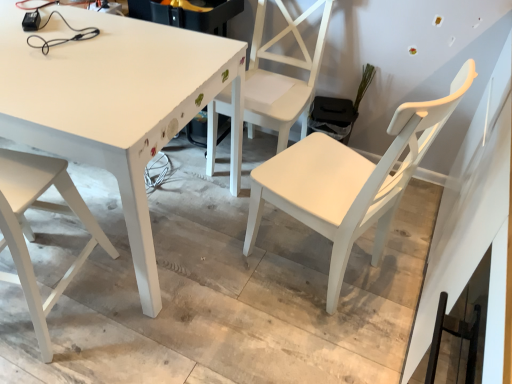
Question: Is white matte chair at lower left, placed as the third chair when sorted from right to left, taller than white matte chair at center, arranged as the second chair when viewed from the right?

Choices:
 (A) no
 (B) yes

Answer: (A)

Question: From a real-world perspective, is white matte chair at lower left, placed as the third chair when sorted from right to left, physically below white matte chair at center, arranged as the second chair when viewed from the right?

Choices:
 (A) yes
 (B) no

Answer: (A)

Question: Is white matte chair at lower left, marked as the first chair in a left-to-right arrangement, beside white matte chair at center, arranged as the second chair when viewed from the right?

Choices:
 (A) no
 (B) yes

Answer: (A)

Question: Is white matte chair at center, arranged as the second chair when viewed from the right, surrounded by white matte chair at lower left, placed as the third chair when sorted from right to left?

Choices:
 (A) no
 (B) yes

Answer: (A)

Question: Considering the relative sizes of white matte chair at lower left, placed as the third chair when sorted from right to left, and white matte chair at center, the second chair viewed from the left, in the image provided, is white matte chair at lower left, placed as the third chair when sorted from right to left, smaller than white matte chair at center, the second chair viewed from the left,?

Choices:
 (A) no
 (B) yes

Answer: (B)

Question: Is white matte chair at lower left, marked as the first chair in a left-to-right arrangement, bigger than white matte chair at center, the second chair viewed from the left?

Choices:
 (A) no
 (B) yes

Answer: (A)

Question: From a real-world perspective, is white painted wood table at center under white matte chair at center, which appears as the 1th chair when viewed from the right?

Choices:
 (A) no
 (B) yes

Answer: (B)

Question: Considering the relative sizes of white painted wood table at center and white matte chair at center, which is the 3th chair from left to right, in the image provided, is white painted wood table at center thinner than white matte chair at center, which is the 3th chair from left to right,?

Choices:
 (A) yes
 (B) no

Answer: (B)

Question: Is white painted wood table at center placed right next to white matte chair at center, which appears as the 1th chair when viewed from the right?

Choices:
 (A) yes
 (B) no

Answer: (B)

Question: Would you say white painted wood table at center contains white matte chair at center, which appears as the 1th chair when viewed from the right?

Choices:
 (A) no
 (B) yes

Answer: (A)

Question: Does white painted wood table at center have a lesser height compared to white matte chair at center, which is the 3th chair from left to right?

Choices:
 (A) yes
 (B) no

Answer: (A)

Question: Does white painted wood table at center have a greater height compared to white matte chair at center, which appears as the 1th chair when viewed from the right?

Choices:
 (A) no
 (B) yes

Answer: (A)

Question: Considering the relative positions of white matte chair at center, which appears as the 1th chair when viewed from the right, and white matte chair at center, the second chair viewed from the left, in the image provided, is white matte chair at center, which appears as the 1th chair when viewed from the right, behind white matte chair at center, the second chair viewed from the left,?

Choices:
 (A) yes
 (B) no

Answer: (B)